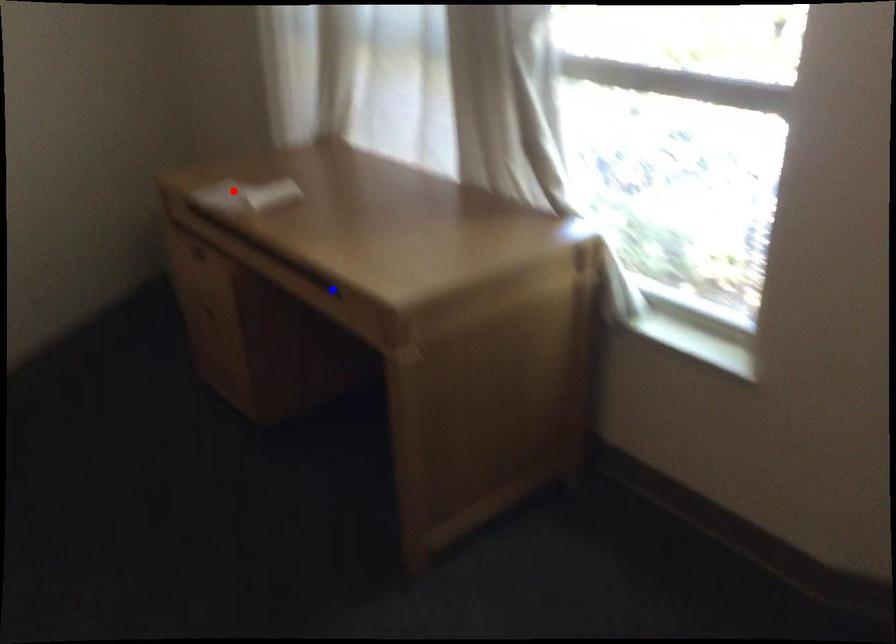
Question: Two points are marked on the image. Which point is closer to the camera?

Choices:
 (A) Blue point is closer.
 (B) Red point is closer.

Answer: (A)